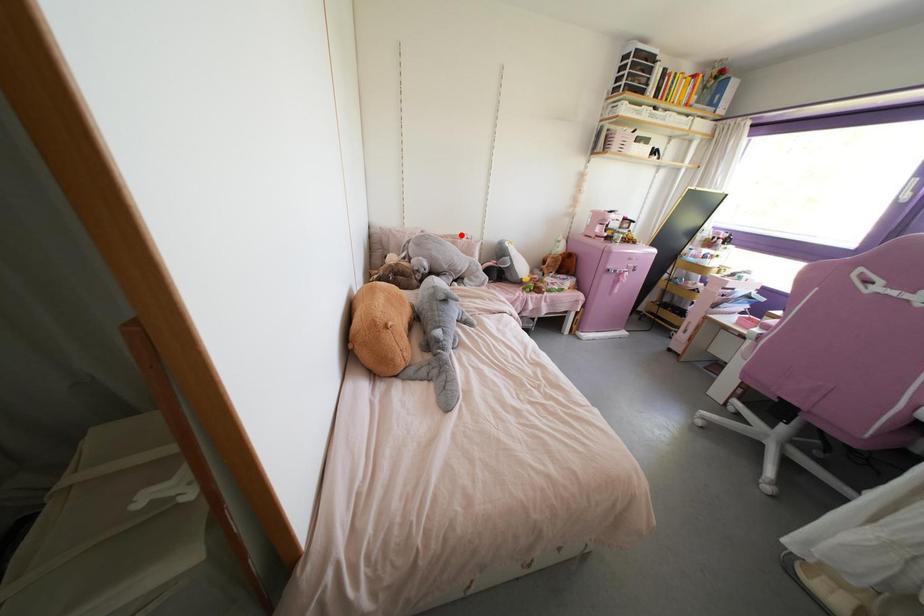
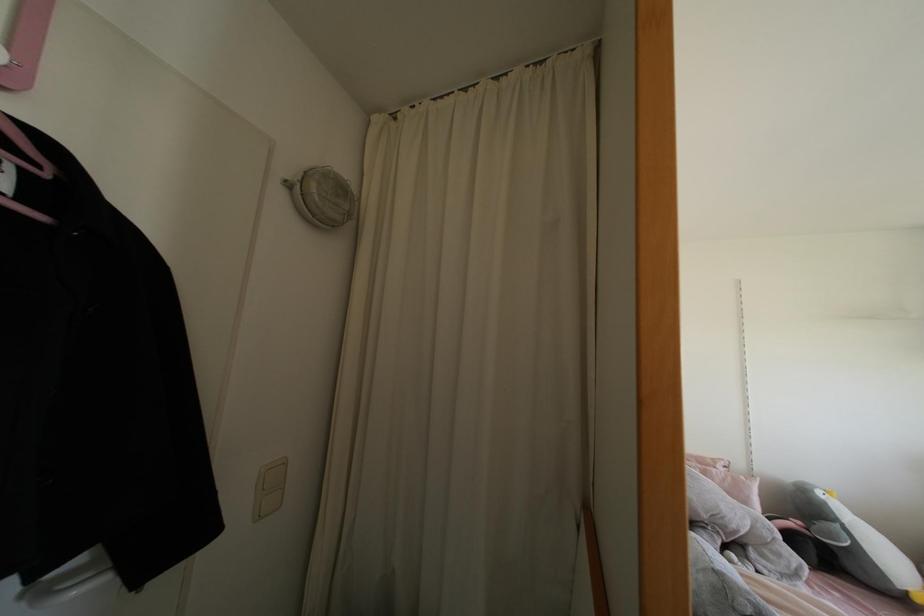
Where in the second image is the point corresponding to the highlighted location from the first image?

(712, 460)